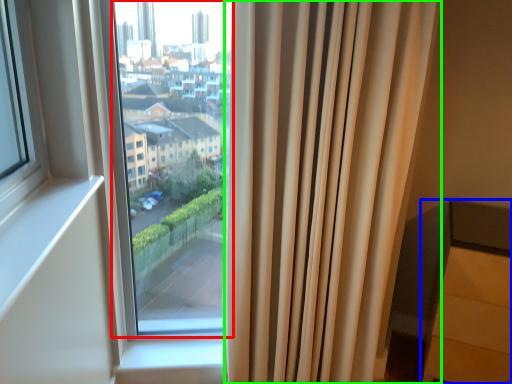
Question: Which object is positioned closest to bay window (highlighted by a red box)? Select from furniture (highlighted by a blue box) and curtain (highlighted by a green box).

Choices:
 (A) furniture
 (B) curtain

Answer: (B)